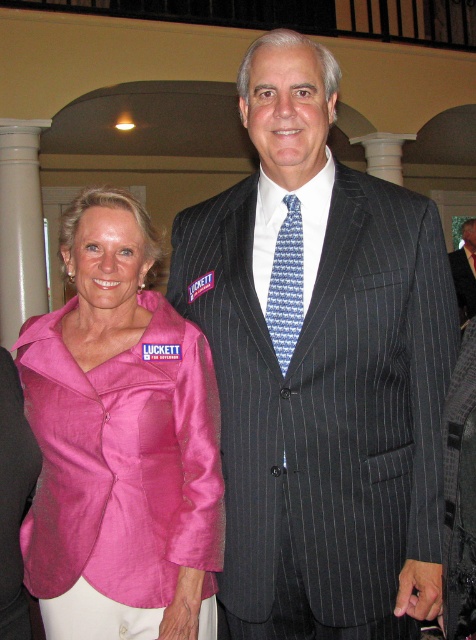
Question: Considering the real-world distances, which object is farthest from the blue printed tie at center?

Choices:
 (A) dark gray pinstripe suit at center
 (B) pink satin blazer at left
 (C) pinstriped suit at center

Answer: (C)

Question: Does pink satin blazer at left appear under blue printed tie at center?

Choices:
 (A) no
 (B) yes

Answer: (B)

Question: In this image, where is dark gray pinstripe suit at center located relative to blue printed tie at center?

Choices:
 (A) left
 (B) right

Answer: (B)

Question: Which object appears farthest from the camera in this image?

Choices:
 (A) dark gray pinstripe suit at center
 (B) blue printed tie at center
 (C) pinstriped suit at center
 (D) pink satin blazer at left

Answer: (C)

Question: Which point is closer to the camera?

Choices:
 (A) (366, 312)
 (B) (467, 259)
 (C) (159, 419)

Answer: (A)

Question: Is dark gray pinstripe suit at center behind pinstriped suit at center?

Choices:
 (A) yes
 (B) no

Answer: (B)